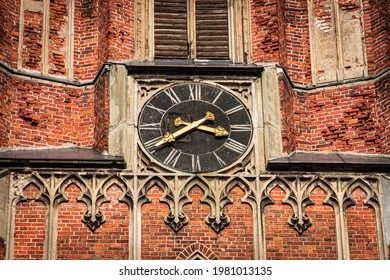
At what (x,y) coordinates should I click in order to perform the action: click on shutters. Please return your answer as a coordinate pair (x, y). This screenshot has width=390, height=280. Looking at the image, I should click on (355, 27), (326, 58), (217, 32), (174, 40), (66, 42), (40, 39).